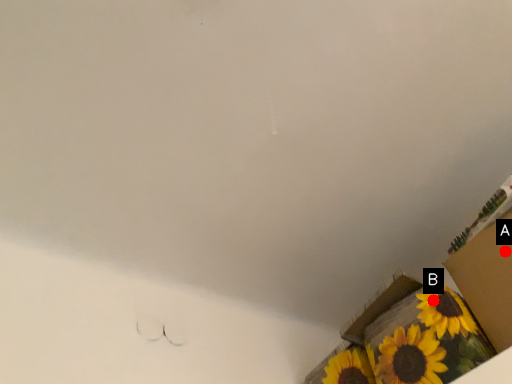
Question: Two points are circled on the image, labeled by A and B beside each circle. Which point is closer to the camera?

Choices:
 (A) A is closer
 (B) B is closer

Answer: (A)